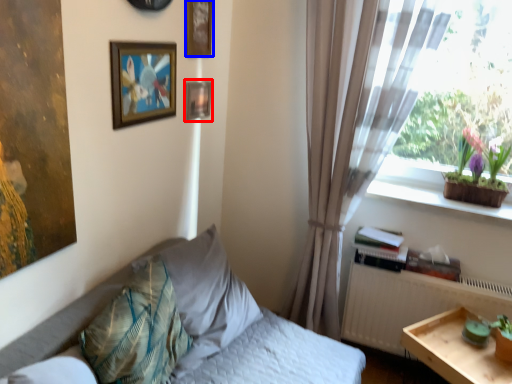
Question: Which point is closer to the camera, picture frame (highlighted by a red box) or picture frame (highlighted by a blue box)?

Choices:
 (A) picture frame
 (B) picture frame

Answer: (B)